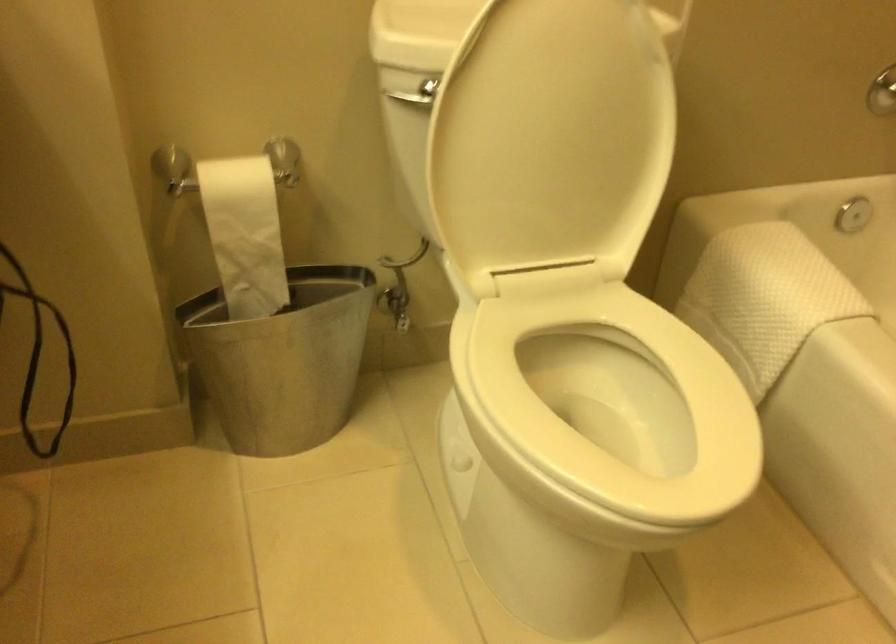
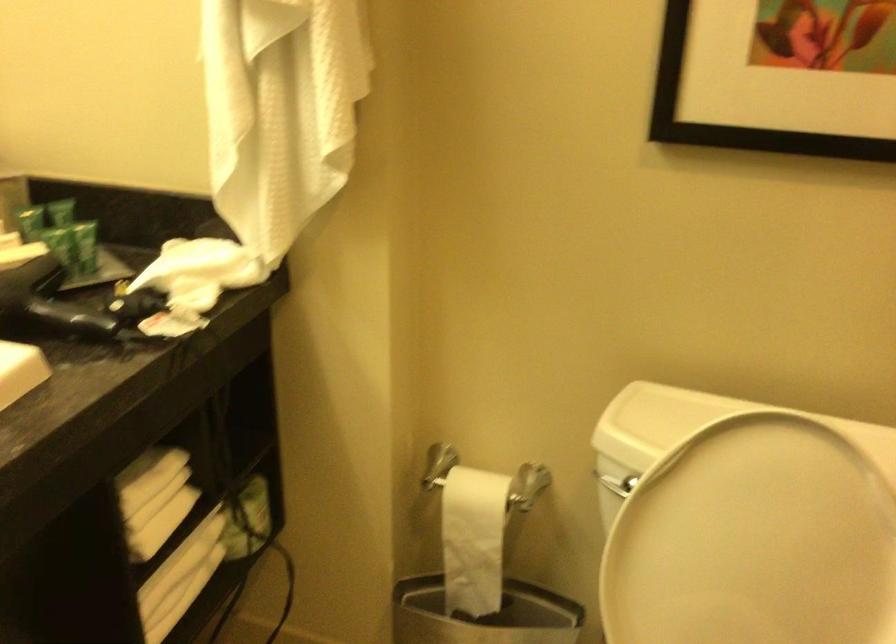
Question: The images are taken continuously from a first-person perspective. In which direction is your viewpoint rotating?

Choices:
 (A) Left
 (B) Right
 (C) Up
 (D) Down

Answer: (A)